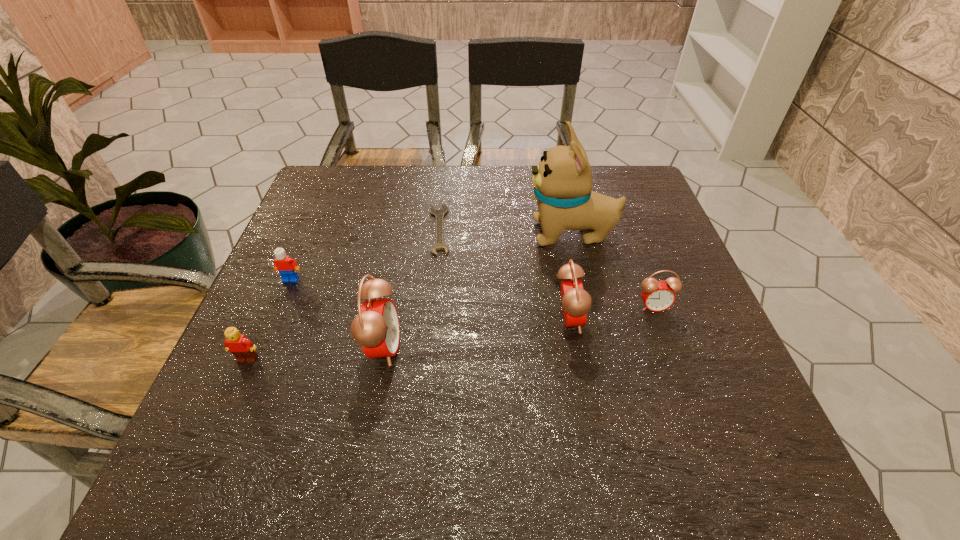
You are a GUI agent. You are given a task and a screenshot of the screen. Output one action in this format:
    pyautogui.click(x=<x>, y=<y>)
    Task: Click on the unoccupied area between the second alarm clock from right to left and the nearer Lego
    This screenshot has height=540, width=960.
    Given the screenshot: What is the action you would take?
    pyautogui.click(x=408, y=339)

The height and width of the screenshot is (540, 960). What are the coordinates of `vacant point located between the puppy and the fifth nearest object` in the screenshot? It's located at (431, 256).

The width and height of the screenshot is (960, 540). Find the location of `vacant point located between the third object from left to right and the nearer Lego`. vacant point located between the third object from left to right and the nearer Lego is located at coordinates (315, 353).

Find the location of a particular element. This screenshot has height=540, width=960. vacant space that's between the nearer Lego and the fourth object from right to left is located at coordinates (344, 295).

You are a GUI agent. You are given a task and a screenshot of the screen. Output one action in this format:
    pyautogui.click(x=<x>, y=<y>)
    Task: Click on the free space between the nearer Lego and the puppy
    The width and height of the screenshot is (960, 540).
    Given the screenshot: What is the action you would take?
    pyautogui.click(x=410, y=296)

Where is `vacant region between the nearer Lego and the second shortest alarm clock`? This screenshot has width=960, height=540. vacant region between the nearer Lego and the second shortest alarm clock is located at coordinates (408, 339).

At what (x,y) coordinates should I click in order to perform the action: click on vacant space that is in between the rightmost alarm clock and the farther Lego. Please return your answer as a coordinate pair (x, y). This screenshot has height=540, width=960. Looking at the image, I should click on (472, 293).

Find the location of `free space between the leftmost alarm clock and the second alarm clock from right to left`. free space between the leftmost alarm clock and the second alarm clock from right to left is located at coordinates (475, 333).

Point out which object is positioned as the fifth nearest to the fifth object from right to left. Please provide its 2D coordinates. Your answer should be formatted as a tuple, i.e. [(x, y)], where the tuple contains the x and y coordinates of a point satisfying the conditions above.

[(562, 181)]

Point out which object is positioned as the third nearest to the tallest object. Please provide its 2D coordinates. Your answer should be formatted as a tuple, i.e. [(x, y)], where the tuple contains the x and y coordinates of a point satisfying the conditions above.

[(439, 214)]